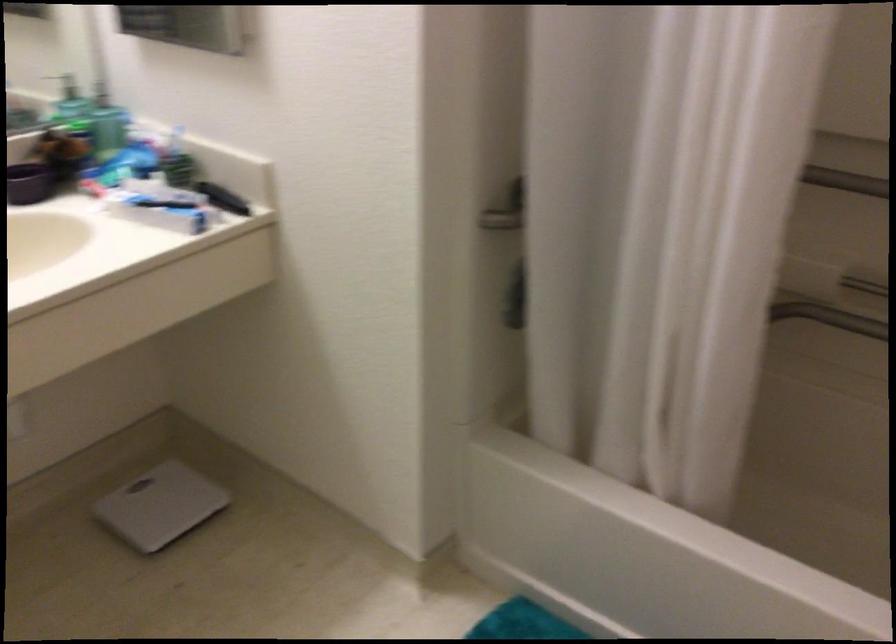
This screenshot has width=896, height=644. I want to click on dispenser pump, so click(x=70, y=93).